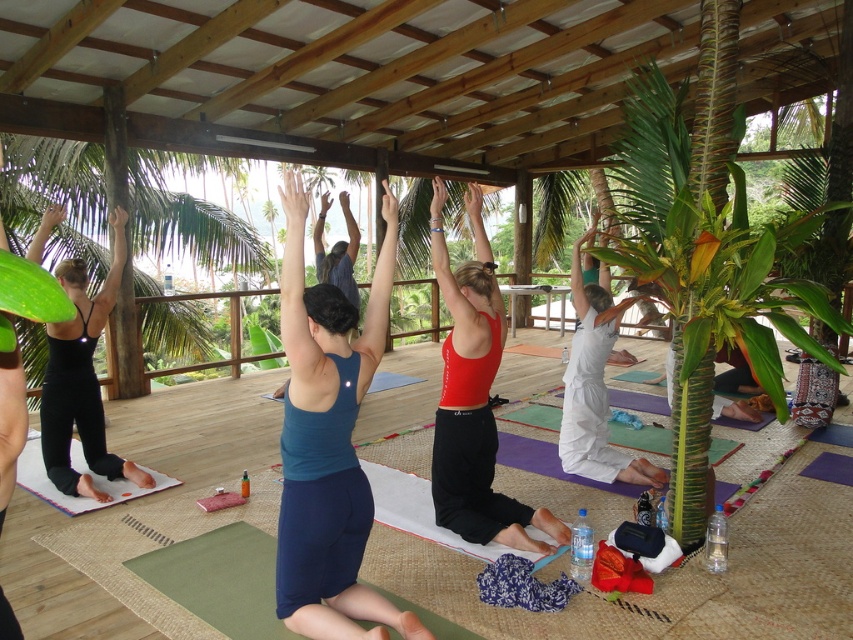
From the picture: Between red matte tank top at center and black matte yoga pants at left, which one appears on the right side from the viewer's perspective?

red matte tank top at center

Locate an element on the screen. red matte tank top at center is located at coordinates (474, 396).

Can you confirm if blue fabric yoga mat at center is positioned above red matte tank top at center?

No, blue fabric yoga mat at center is not above red matte tank top at center.

Who is taller, blue fabric yoga mat at center or red matte tank top at center?

red matte tank top at center

Where is `blue fabric yoga mat at center`? blue fabric yoga mat at center is located at coordinates 329,442.

You are a GUI agent. You are given a task and a screenshot of the screen. Output one action in this format:
    pyautogui.click(x=<x>, y=<y>)
    Task: Click on the blue fabric yoga mat at center
    The image size is (853, 640).
    Given the screenshot: What is the action you would take?
    pyautogui.click(x=329, y=442)

Is black matte yoga pants at left further to camera compared to white cotton yoga pants at lower right?

No.

Is black matte yoga pants at left positioned in front of white cotton yoga pants at lower right?

Yes, it is in front of white cotton yoga pants at lower right.

The width and height of the screenshot is (853, 640). What do you see at coordinates (82, 380) in the screenshot?
I see `black matte yoga pants at left` at bounding box center [82, 380].

The image size is (853, 640). What are the coordinates of `black matte yoga pants at left` in the screenshot? It's located at (82, 380).